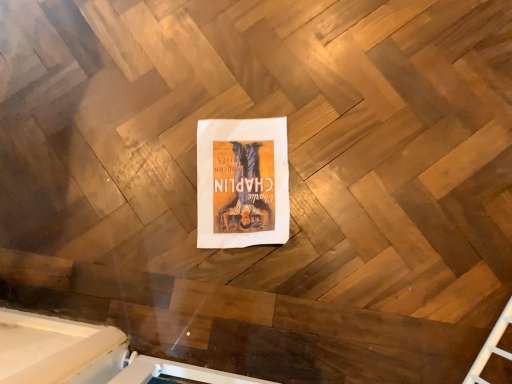
Where is `free spot in front of white paper poster at center`? free spot in front of white paper poster at center is located at coordinates (259, 286).